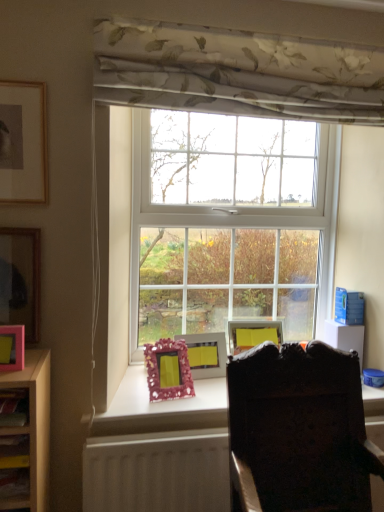
Question: Does pink matte picture frame at left, arranged as the 3th picture frame when viewed from the front, have a larger size compared to pink glittery picture frame at center, positioned as the 4th picture frame in front-to-back order?

Choices:
 (A) yes
 (B) no

Answer: (B)

Question: Would you say pink matte picture frame at left, arranged as the 3th picture frame when viewed from the front, is a long distance from pink glittery picture frame at center, the 1th picture frame in the bottom-to-top sequence?

Choices:
 (A) no
 (B) yes

Answer: (A)

Question: From the image's perspective, is pink matte picture frame at left, marked as the fifth picture frame in a right-to-left arrangement, located above pink glittery picture frame at center, which appears as the 4th picture frame when viewed from the left?

Choices:
 (A) no
 (B) yes

Answer: (B)

Question: Does pink matte picture frame at left, the 4th picture frame ordered from the bottom, appear on the left side of pink glittery picture frame at center, the 1th picture frame in the bottom-to-top sequence?

Choices:
 (A) yes
 (B) no

Answer: (A)

Question: Would you say pink matte picture frame at left, marked as the fifth picture frame in a right-to-left arrangement, is outside pink glittery picture frame at center, the second picture frame from the right?

Choices:
 (A) no
 (B) yes

Answer: (B)

Question: From a real-world perspective, is dark wood desk at lower center above or below white plastic window at center?

Choices:
 (A) below
 (B) above

Answer: (A)

Question: Is point (170, 464) positioned closer to the camera than point (210, 130)?

Choices:
 (A) closer
 (B) farther

Answer: (A)

Question: Is dark wood desk at lower center wider or thinner than white plastic window at center?

Choices:
 (A) thin
 (B) wide

Answer: (B)

Question: In the image, is dark wood desk at lower center on the left side or the right side of white plastic window at center?

Choices:
 (A) right
 (B) left

Answer: (B)

Question: Would you say floral fabric curtain at upper center is inside or outside matte pink picture frame at center, which is the second picture frame from bottom to top?

Choices:
 (A) outside
 (B) inside

Answer: (A)

Question: From the image's perspective, is floral fabric curtain at upper center above or below matte pink picture frame at center, which is counted as the 4th picture frame, starting from the top?

Choices:
 (A) below
 (B) above

Answer: (B)

Question: Visually, is floral fabric curtain at upper center positioned to the left or to the right of matte pink picture frame at center, which appears as the 1th picture frame when viewed from the right?

Choices:
 (A) left
 (B) right

Answer: (B)

Question: From their relative heights in the image, would you say floral fabric curtain at upper center is taller or shorter than matte pink picture frame at center, the first picture frame in the back-to-front sequence?

Choices:
 (A) short
 (B) tall

Answer: (B)

Question: From the image's perspective, is pink matte picture frame at left, the 4th picture frame ordered from the bottom, located above or below matte pink shelf at lower left?

Choices:
 (A) above
 (B) below

Answer: (A)

Question: Choose the correct answer: Is pink matte picture frame at left, arranged as the 3th picture frame when viewed from the front, inside matte pink shelf at lower left or outside it?

Choices:
 (A) outside
 (B) inside

Answer: (A)